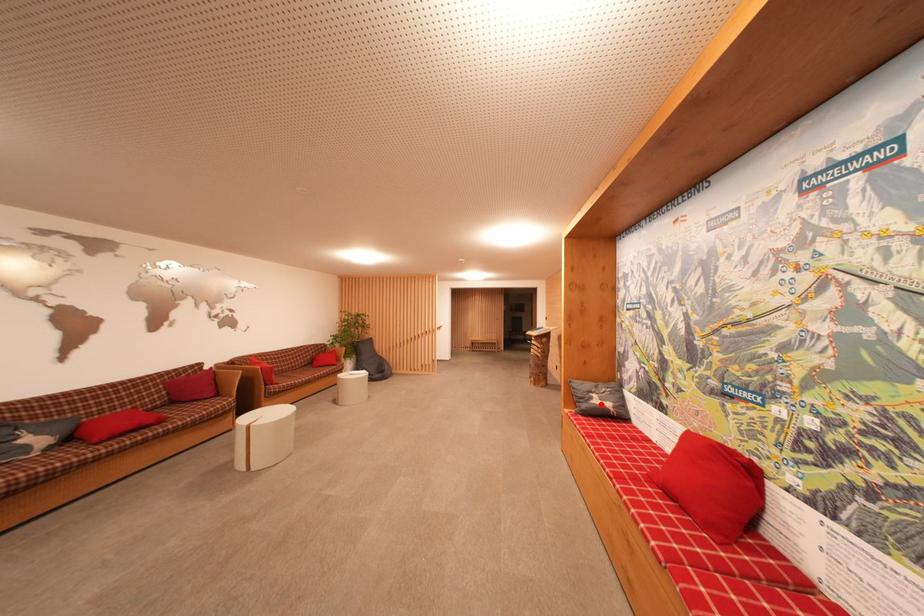
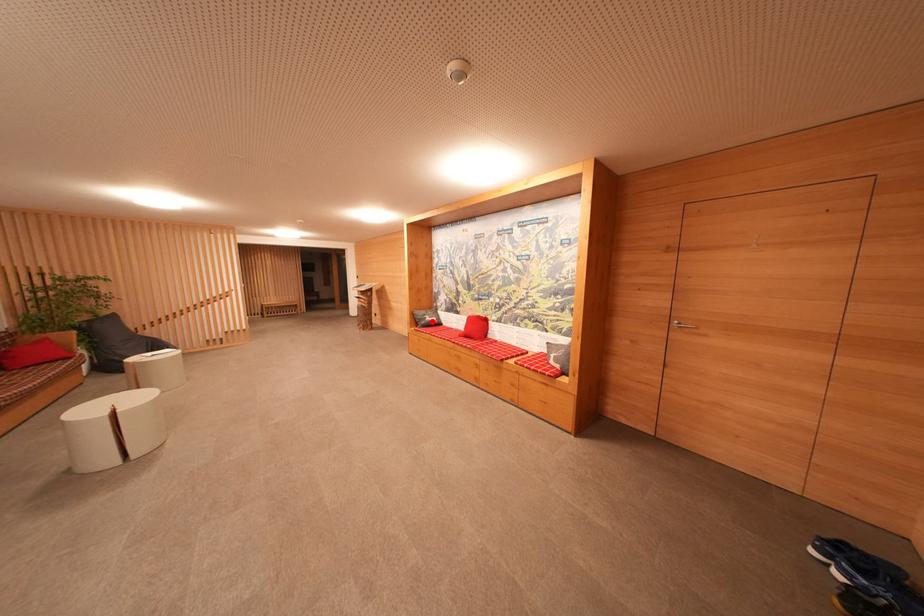
I am providing you with two images of the same scene from different viewpoints. A red point is marked on the first image and another point is marked on the second image. Do the highlighted points in image1 and image2 indicate the same real-world spot?

Yes